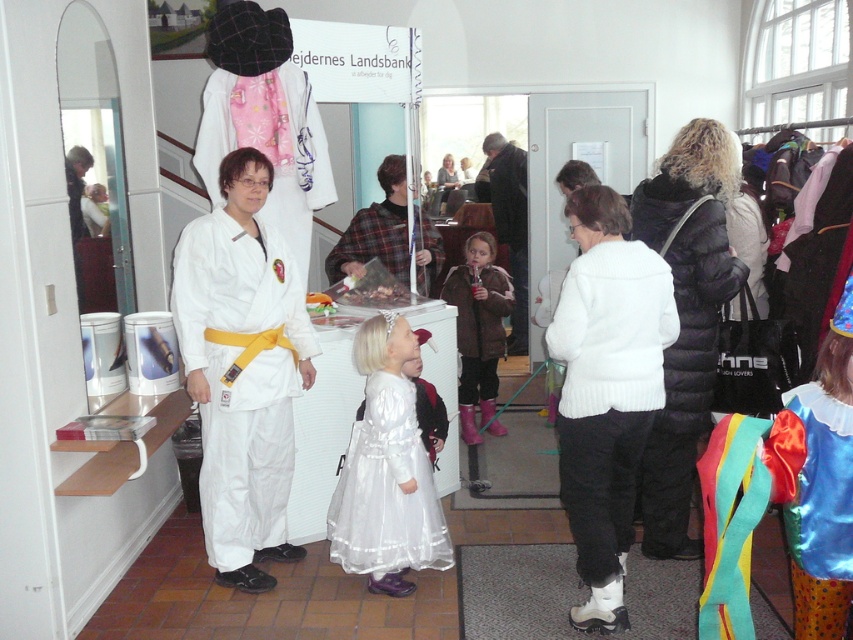
I want to click on white karate uniform at center, so click(242, 369).

Is white karate uniform at center smaller than silky blue dress at center?

Incorrect, white karate uniform at center is not smaller in size than silky blue dress at center.

Which is in front, point (218, 454) or point (844, 604)?

Point (844, 604) is more forward.

I want to click on white karate uniform at center, so click(x=242, y=369).

Is point (363, 493) closer to viewer compared to point (495, 227)?

Yes, it is in front of point (495, 227).

I want to click on white satin dress at center, so click(x=386, y=490).

Is white knitted sweater at center taller than plaid fabric shirt at center?

Yes.

Between point (589, 438) and point (396, 163), which one is positioned in front?

Point (589, 438) is more forward.

Does point (601, 472) come behind point (424, 289)?

No, (601, 472) is closer to viewer.

Where is `white knitted sweater at center`? This screenshot has width=853, height=640. white knitted sweater at center is located at coordinates (606, 388).